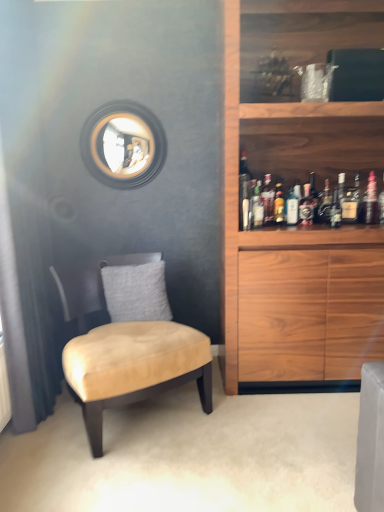
Question: Is translucent glass bottle at upper right, which is the sixth bottle from left to right, wider than translucent glass bottle at upper right, acting as the 8th bottle starting from the right?

Choices:
 (A) no
 (B) yes

Answer: (B)

Question: From the image's perspective, would you say translucent glass bottle at upper right, which is the sixth bottle from left to right, is positioned over translucent glass bottle at upper right, the 2th bottle positioned from the left?

Choices:
 (A) no
 (B) yes

Answer: (B)

Question: Is translucent glass bottle at upper right, the 4th bottle when ordered from right to left, with translucent glass bottle at upper right, acting as the 8th bottle starting from the right?

Choices:
 (A) no
 (B) yes

Answer: (A)

Question: Is the position of translucent glass bottle at upper right, the 4th bottle when ordered from right to left, more distant than that of translucent glass bottle at upper right, acting as the 8th bottle starting from the right?

Choices:
 (A) no
 (B) yes

Answer: (B)

Question: Considering the relative sizes of translucent glass bottle at upper right, which is the sixth bottle from left to right, and translucent glass bottle at upper right, acting as the 8th bottle starting from the right, in the image provided, is translucent glass bottle at upper right, which is the sixth bottle from left to right, smaller than translucent glass bottle at upper right, acting as the 8th bottle starting from the right,?

Choices:
 (A) no
 (B) yes

Answer: (A)

Question: Based on their sizes in the image, would you say translucent glass bottle at center, positioned as the fifth bottle in left-to-right order, is bigger or smaller than gray fuzzy pillow at center?

Choices:
 (A) big
 (B) small

Answer: (B)

Question: Is translucent glass bottle at center, which appears as the fifth bottle when viewed from the right, situated inside gray fuzzy pillow at center or outside?

Choices:
 (A) outside
 (B) inside

Answer: (A)

Question: Looking at their shapes, would you say translucent glass bottle at center, which appears as the fifth bottle when viewed from the right, is wider or thinner than gray fuzzy pillow at center?

Choices:
 (A) wide
 (B) thin

Answer: (B)

Question: From a real-world perspective, is translucent glass bottle at center, which appears as the fifth bottle when viewed from the right, positioned above or below gray fuzzy pillow at center?

Choices:
 (A) above
 (B) below

Answer: (A)

Question: Which is correct: suede-like beige chair at left is inside translucent glass bottle at upper right, acting as the ninth bottle starting from the left, or outside of it?

Choices:
 (A) inside
 (B) outside

Answer: (B)

Question: From the image's perspective, is suede-like beige chair at left above or below translucent glass bottle at upper right, the first bottle from the right?

Choices:
 (A) below
 (B) above

Answer: (A)

Question: From a real-world perspective, is suede-like beige chair at left physically located above or below translucent glass bottle at upper right, acting as the ninth bottle starting from the left?

Choices:
 (A) above
 (B) below

Answer: (B)

Question: Based on their sizes in the image, would you say suede-like beige chair at left is bigger or smaller than translucent glass bottle at upper right, the first bottle from the right?

Choices:
 (A) big
 (B) small

Answer: (A)

Question: Looking at their shapes, would you say translucent glass bottle at upper right, which is counted as the seventh bottle, starting from the left, is wider or thinner than translucent glass bottle at upper right, the 4th bottle when ordered from right to left?

Choices:
 (A) thin
 (B) wide

Answer: (B)

Question: Considering the positions of translucent glass bottle at upper right, which is counted as the seventh bottle, starting from the left, and translucent glass bottle at upper right, which is the sixth bottle from left to right, in the image, is translucent glass bottle at upper right, which is counted as the seventh bottle, starting from the left, bigger or smaller than translucent glass bottle at upper right, which is the sixth bottle from left to right,?

Choices:
 (A) small
 (B) big

Answer: (B)